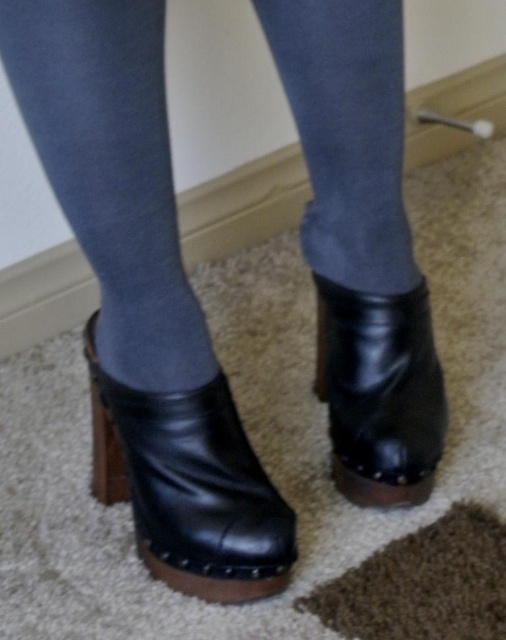
You are standing in a room and see two points marked on the floor. The first point is at coordinates point [118,100] and the second is at point [374,358]. If you are facing the wall with the baseboard, which point is closer to you?

Point [118,100] is in front of point [374,358], so if you are facing the wall with the baseboard, point [118,100] is closer to you.

In the scene shown: What is located at the coordinates point [111,172]?

Denim jeans at center is located at point [111,172].

You are standing 30 inches away from the point at coordinates (296, 12). Can you step forward to touch it without moving your feet?

The distance of point (296, 12) from viewer is 26.75 inches. Since you are currently 30 inches away, stepping forward would bring you closer, but you need to be at least 26.75 inches away to touch it. However, stepping forward reduces the distance, so you can move closer until you are within reach. If your outstretched hand can reach within 26.75 inches, then yes, you can touch it by moving forward 3.25 inches.